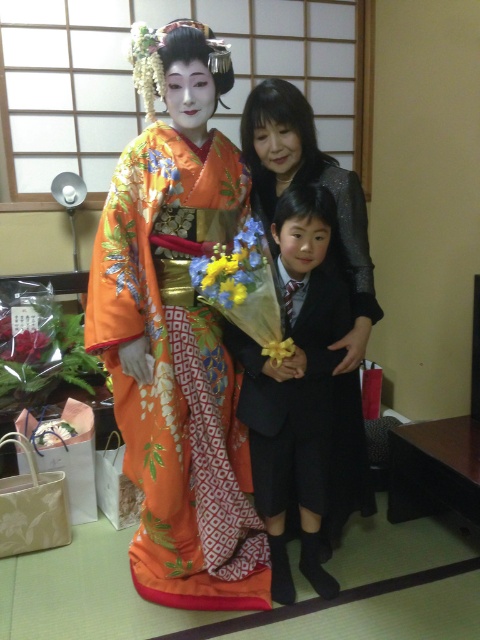
Does orange silk kimono at center lie behind yellow matte flower at center?

That is True.

Locate an element on the screen. The image size is (480, 640). orange silk kimono at center is located at coordinates (178, 371).

Does orange silk kimono at center appear on the left side of yellow fabric flower at center?

Answer: Indeed, orange silk kimono at center is positioned on the left side of yellow fabric flower at center.

Is point (153, 236) closer to camera compared to point (280, 356)?

No, it is not.

You are a GUI agent. You are given a task and a screenshot of the screen. Output one action in this format:
    pyautogui.click(x=<x>, y=<y>)
    Task: Click on the orange silk kimono at center
    The image size is (480, 640).
    Given the screenshot: What is the action you would take?
    pyautogui.click(x=178, y=371)

In the scene shown: Is yellow matte flower at center positioned at the back of yellow fabric flower at center?

No, yellow matte flower at center is in front of yellow fabric flower at center.

Does yellow matte flower at center appear under yellow fabric flower at center?

No, yellow matte flower at center is not below yellow fabric flower at center.

Identify the location of yellow matte flower at center. The width and height of the screenshot is (480, 640). (230, 268).